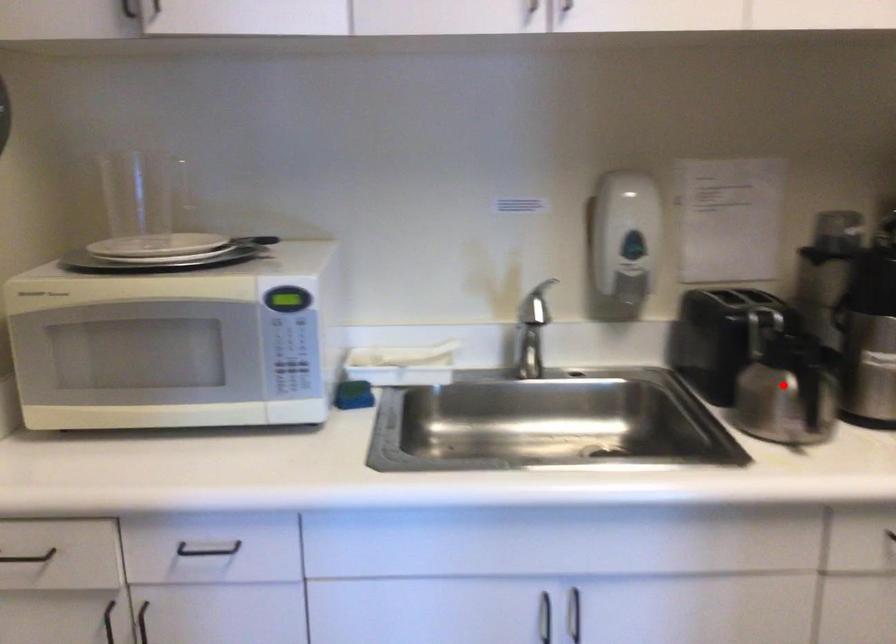
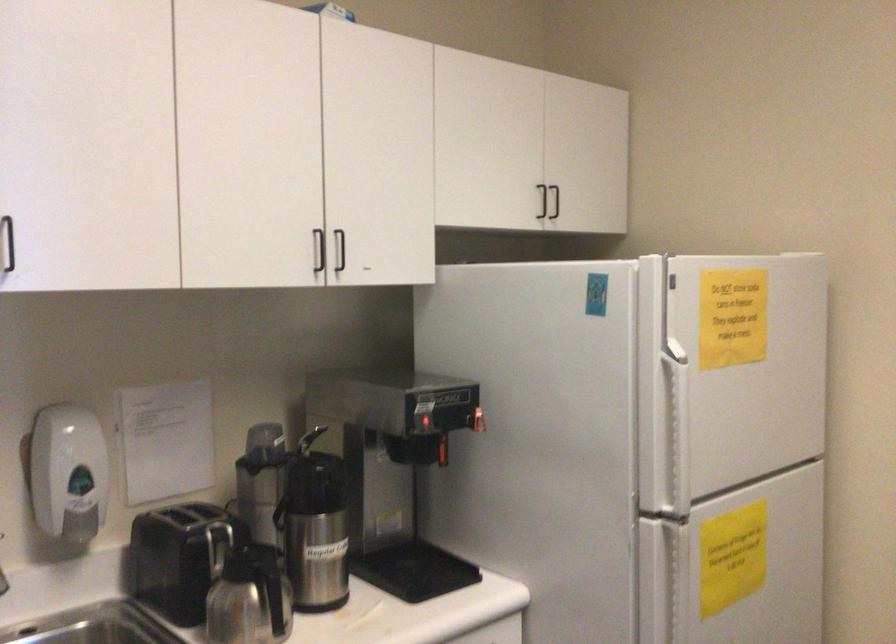
Where in the second image is the point corresponding to the highlighted location from the first image?

(251, 599)